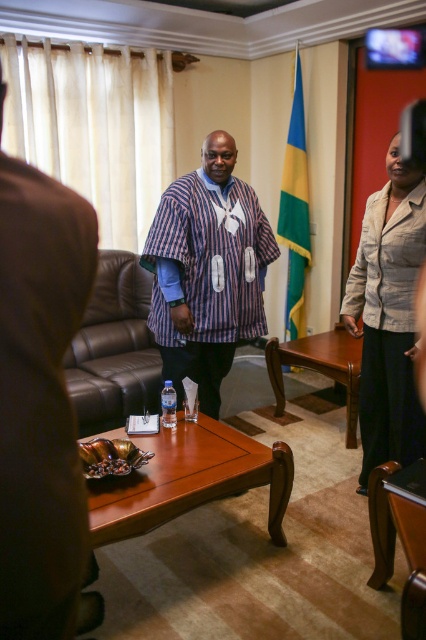
Question: Does striped fabric shirt at center have a greater width compared to mahogany wood table at center?

Choices:
 (A) yes
 (B) no

Answer: (B)

Question: Which of the following is the farthest from the observer?

Choices:
 (A) (210, 248)
 (B) (348, 410)

Answer: (B)

Question: Which object is closer to the camera taking this photo?

Choices:
 (A) striped fabric at center
 (B) striped fabric shirt at center
 (C) light beige fabric jacket at right
 (D) mahogany wood table at center

Answer: (A)

Question: Does striped fabric shirt at center have a greater width compared to mahogany wood table at center?

Choices:
 (A) yes
 (B) no

Answer: (B)

Question: Does striped fabric at center have a greater width compared to striped fabric shirt at center?

Choices:
 (A) no
 (B) yes

Answer: (A)

Question: Which point is closer to the camera taking this photo?

Choices:
 (A) (181, 346)
 (B) (299, 125)
 (C) (0, 508)
 (D) (382, 412)

Answer: (C)